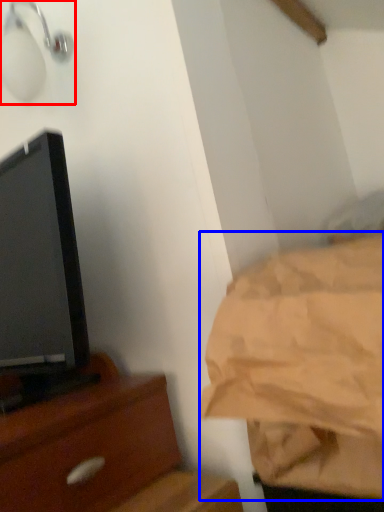
Question: Which object is further to the camera taking this photo, light fixture (highlighted by a red box) or sheet (highlighted by a blue box)?

Choices:
 (A) light fixture
 (B) sheet

Answer: (A)